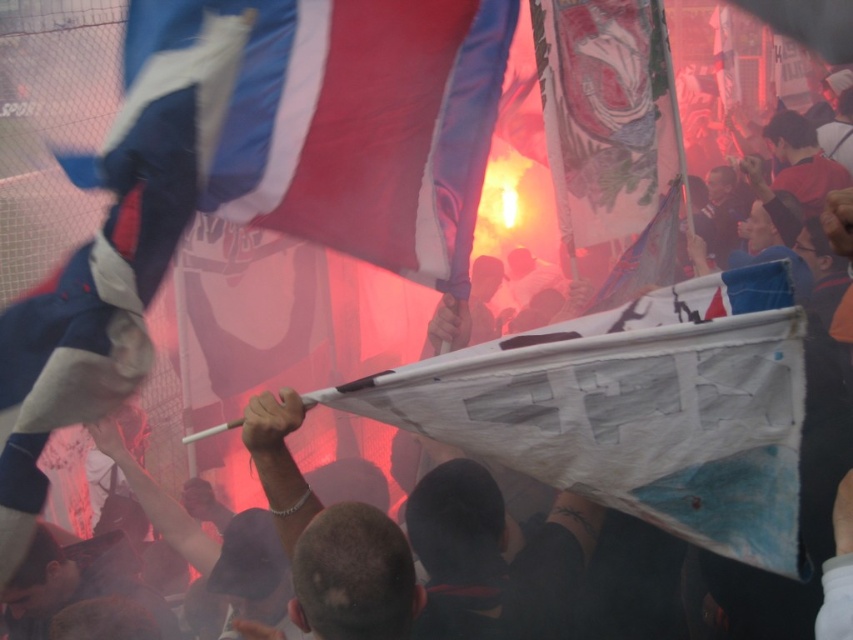
Can you confirm if blue fabric flag at upper left is positioned to the left of white paper flag at center?

Yes, blue fabric flag at upper left is to the left of white paper flag at center.

Is point (25, 440) positioned in front of point (544, 77)?

Yes, it is in front of point (544, 77).

Where is `blue fabric flag at upper left`? The height and width of the screenshot is (640, 853). blue fabric flag at upper left is located at coordinates (113, 259).

Locate an element on the screen. Image resolution: width=853 pixels, height=640 pixels. blue fabric flag at upper left is located at coordinates (113, 259).

Who is positioned more to the right, blue and white fabric flag at upper left or blue fabric flag at upper left?

blue and white fabric flag at upper left is more to the right.

Does point (405, 211) come closer to viewer compared to point (105, 323)?

No, it is not.

Where is `blue and white fabric flag at upper left`? Image resolution: width=853 pixels, height=640 pixels. blue and white fabric flag at upper left is located at coordinates (352, 122).

Is blue and white fabric flag at upper left behind white paper flag at center?

No, it is not.

What do you see at coordinates (352, 122) in the screenshot? I see `blue and white fabric flag at upper left` at bounding box center [352, 122].

Does point (175, 20) come closer to viewer compared to point (572, 204)?

Yes.

Identify the location of blue and white fabric flag at upper left. (352, 122).